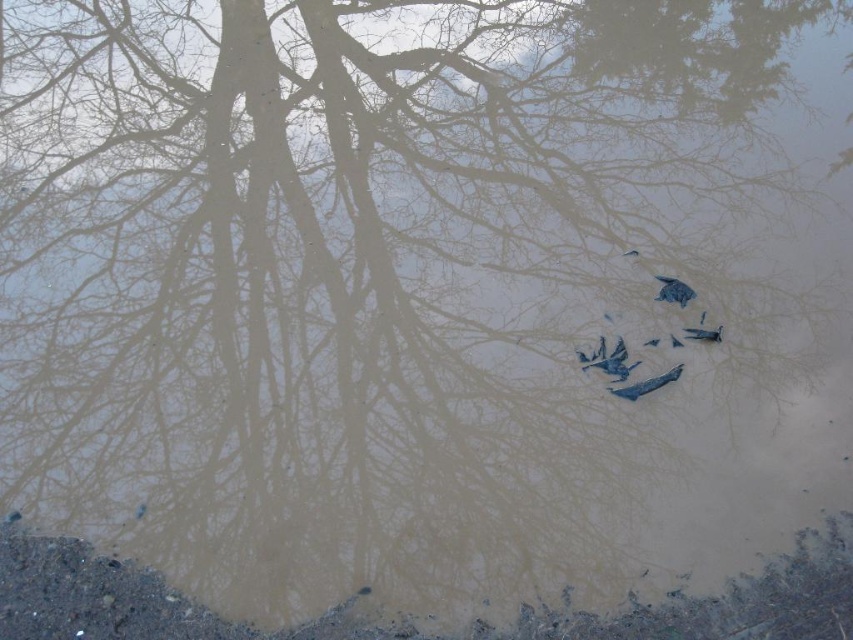
Question: Which point is farther to the camera?

Choices:
 (A) shiny silver bird at upper center
 (B) shiny metallic bird at center
 (C) blue paper at center

Answer: (A)

Question: Which point is farther to the camera?

Choices:
 (A) (639, 381)
 (B) (711, 330)

Answer: (B)

Question: Is blue paper at center closer to the viewer compared to shiny silver bird at upper center?

Choices:
 (A) no
 (B) yes

Answer: (B)

Question: Is the position of blue paper at center more distant than that of shiny silver bird at upper center?

Choices:
 (A) no
 (B) yes

Answer: (A)

Question: Does blue feathered bird at center have a larger size compared to blue matte bird at center?

Choices:
 (A) yes
 (B) no

Answer: (A)

Question: Which point is closer to the camera taking this photo?

Choices:
 (A) coord(683,332)
 (B) coord(792,576)

Answer: (B)